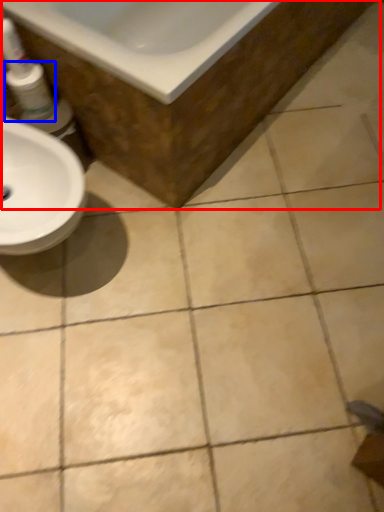
Question: Which object appears farthest to the camera in this image, bath (highlighted by a red box) or mouthwash (highlighted by a blue box)?

Choices:
 (A) bath
 (B) mouthwash

Answer: (B)